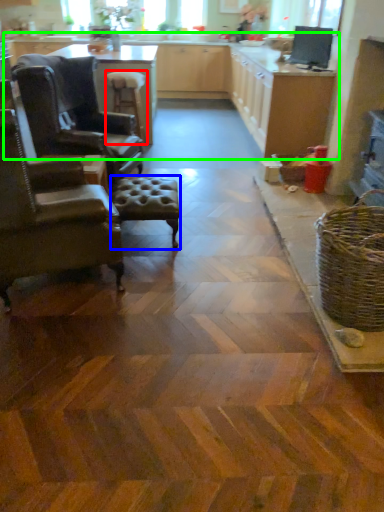
Question: Which object is the closest to the stool (highlighted by a red box)? Choose among these: stool (highlighted by a blue box) or counter top (highlighted by a green box).

Choices:
 (A) stool
 (B) counter top

Answer: (B)